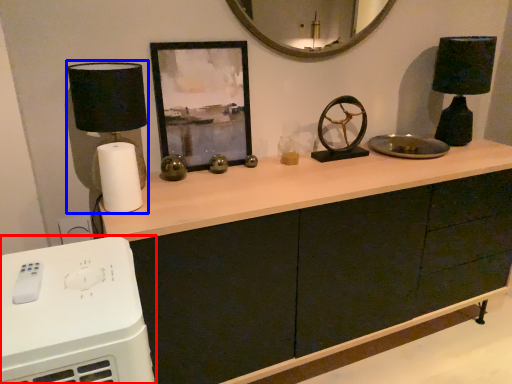
Question: Which of the following is the closest to the observer, home appliance (highlighted by a red box) or table lamp (highlighted by a blue box)?

Choices:
 (A) home appliance
 (B) table lamp

Answer: (A)